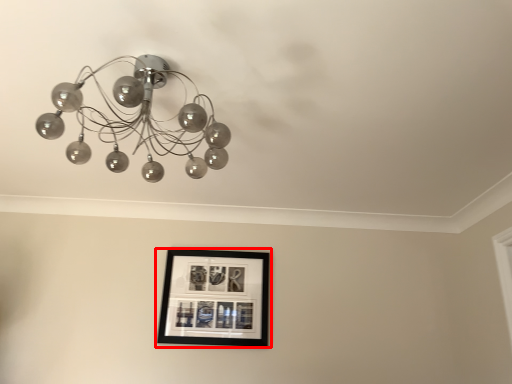
Question: Considering the relative positions of picture frame (annotated by the red box) and lamp in the image provided, where is picture frame (annotated by the red box) located with respect to the staircase?

Choices:
 (A) right
 (B) left

Answer: (A)